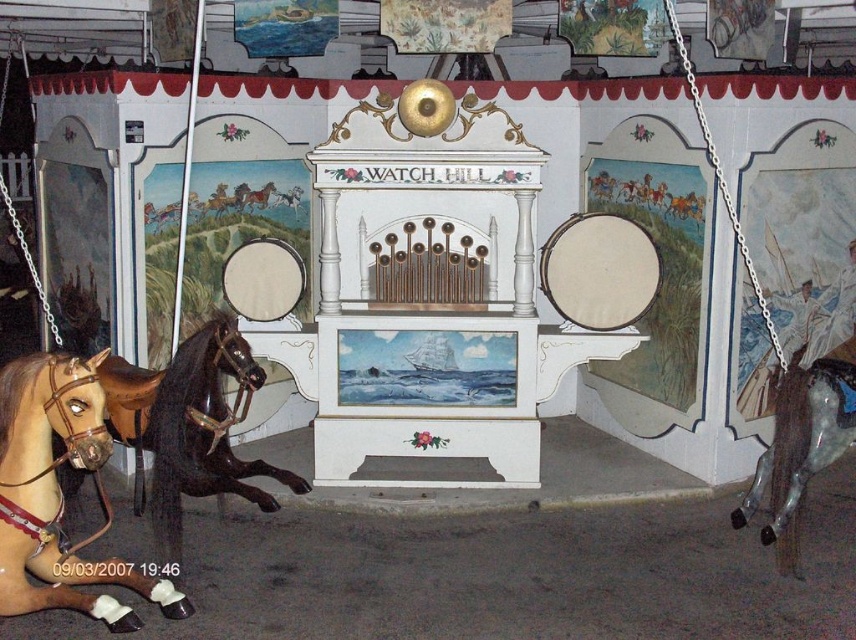
What are the exact coordinates of the brown glossy horse at left in the image?

The brown glossy horse at left is located at the coordinates point (189,424).

You are a visitor at the carousel and want to take a photo of both brown glossy horse at lower left and brown glossy horse at left. Which horse is closer to the ground?

The brown glossy horse at lower left is shorter than the brown glossy horse at left, so the brown glossy horse at lower left is closer to the ground.